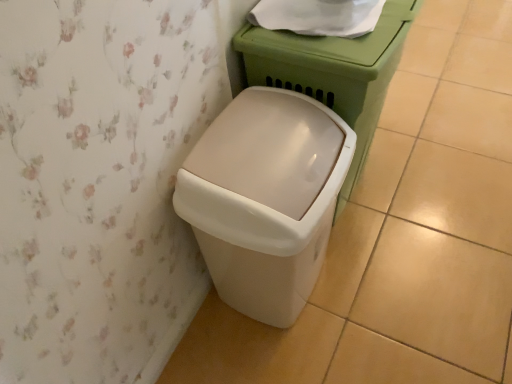
You are a GUI agent. You are given a task and a screenshot of the screen. Output one action in this format:
    pyautogui.click(x=<x>, y=<y>)
    Task: Click on the white glossy porcelain at center
    The height and width of the screenshot is (384, 512).
    Given the screenshot: What is the action you would take?
    pyautogui.click(x=333, y=71)

What is the approximate width of white paper at upper center?

white paper at upper center is 9.42 inches wide.

You are a GUI agent. You are given a task and a screenshot of the screen. Output one action in this format:
    pyautogui.click(x=<x>, y=<y>)
    Task: Click on the beige plastic waste container at lower left
    Image resolution: width=512 pixels, height=384 pixels.
    Given the screenshot: What is the action you would take?
    pyautogui.click(x=265, y=198)

From a real-world perspective, is white paper at upper center positioned above or below beige plastic waste container at lower left?

white paper at upper center is situated higher than beige plastic waste container at lower left in the real world.

What's the angular difference between white paper at upper center and beige plastic waste container at lower left's facing directions?

white paper at upper center and beige plastic waste container at lower left are facing 0.000232 degrees away from each other.

Who is shorter, white paper at upper center or beige plastic waste container at lower left?

With less height is white paper at upper center.

Considering the relative sizes of white paper at upper center and beige plastic waste container at lower left in the image provided, is white paper at upper center smaller than beige plastic waste container at lower left?

Correct, white paper at upper center occupies less space than beige plastic waste container at lower left.

Is beige plastic waste container at lower left looking in the opposite direction of white glossy porcelain at center?

No, beige plastic waste container at lower left is not facing away from white glossy porcelain at center.

From the image's perspective, is beige plastic waste container at lower left on top of white glossy porcelain at center?

Actually, beige plastic waste container at lower left appears below white glossy porcelain at center in the image.

Which is correct: beige plastic waste container at lower left is inside white glossy porcelain at center, or outside of it?

beige plastic waste container at lower left cannot be found inside white glossy porcelain at center.

Can you tell me how much white glossy porcelain at center and white paper at upper center differ in facing direction?

The angular difference between white glossy porcelain at center and white paper at upper center is 0.000272 degrees.

Who is shorter, white glossy porcelain at center or white paper at upper center?

With less height is white paper at upper center.

Is white glossy porcelain at center to the left or to the right of white paper at upper center in the image?

From the image, it's evident that white glossy porcelain at center is to the right of white paper at upper center.

In the scene shown: Is the position of white glossy porcelain at center less distant than that of beige plastic waste container at lower left?

No, the depth of white glossy porcelain at center is greater than that of beige plastic waste container at lower left.

Does white glossy porcelain at center appear on the right side of beige plastic waste container at lower left?

Correct, you'll find white glossy porcelain at center to the right of beige plastic waste container at lower left.

Considering the sizes of objects white glossy porcelain at center and beige plastic waste container at lower left in the image provided, who is thinner, white glossy porcelain at center or beige plastic waste container at lower left?

beige plastic waste container at lower left.

Could you tell me if white glossy porcelain at center is turned towards beige plastic waste container at lower left?

No, white glossy porcelain at center does not turn towards beige plastic waste container at lower left.

Considering the sizes of objects white paper at upper center and white glossy porcelain at center in the image provided, who is thinner, white paper at upper center or white glossy porcelain at center?

Thinner between the two is white paper at upper center.

From a real-world perspective, is white paper at upper center over white glossy porcelain at center?

Indeed, from a real-world perspective, white paper at upper center stands above white glossy porcelain at center.

Locate an element on the screen. The width and height of the screenshot is (512, 384). porcelain below the white paper at upper center (from the image's perspective) is located at coordinates (333, 71).

Is white paper at upper center to the right of white glossy porcelain at center from the viewer's perspective?

No, white paper at upper center is not to the right of white glossy porcelain at center.

The width and height of the screenshot is (512, 384). I want to click on waste container located underneath the white paper at upper center (from a real-world perspective), so click(265, 198).

Is beige plastic waste container at lower left situated inside white paper at upper center or outside?

beige plastic waste container at lower left exists outside the volume of white paper at upper center.

From the image's perspective, between beige plastic waste container at lower left and white paper at upper center, which one is located above?

white paper at upper center is shown above in the image.

Is point (320, 115) closer or farther from the camera than point (314, 17)?

Point (320, 115) is closer to the camera than point (314, 17).

The width and height of the screenshot is (512, 384). What are the coordinates of `waste container located on the left of white paper at upper center` in the screenshot? It's located at (265, 198).

This screenshot has width=512, height=384. What are the coordinates of `waste container in front of the white glossy porcelain at center` in the screenshot? It's located at (265, 198).

Based on the photo, considering their positions, is white paper at upper center positioned closer to beige plastic waste container at lower left than white glossy porcelain at center?

The object closer to beige plastic waste container at lower left is white glossy porcelain at center.

Considering their positions, is white paper at upper center positioned closer to white glossy porcelain at center than beige plastic waste container at lower left?

white paper at upper center is positioned closer to the anchor white glossy porcelain at center.

When comparing their distances from white paper at upper center, does beige plastic waste container at lower left or white glossy porcelain at center seem closer?

white glossy porcelain at center is positioned closer to the anchor white paper at upper center.

From the picture: Based on their spatial positions, is white glossy porcelain at center or white paper at upper center further from beige plastic waste container at lower left?

white paper at upper center.

Which object lies further to the anchor point white paper at upper center, white glossy porcelain at center or beige plastic waste container at lower left?

beige plastic waste container at lower left is positioned further to the anchor white paper at upper center.

Looking at the image, which one is located further to white glossy porcelain at center, beige plastic waste container at lower left or white paper at upper center?

Based on the image, beige plastic waste container at lower left appears to be further to white glossy porcelain at center.

Locate an element on the screen. Image resolution: width=512 pixels, height=384 pixels. porcelain between white paper at upper center and beige plastic waste container at lower left in the up-down direction is located at coordinates (333, 71).